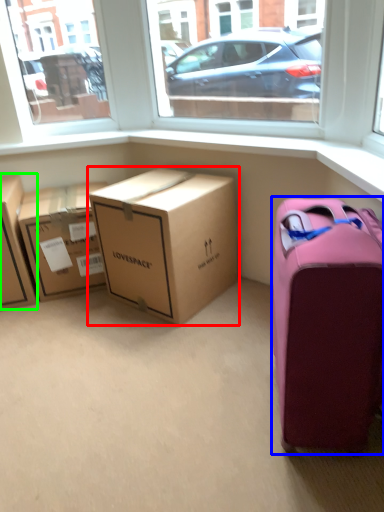
Question: Which object is the farthest from box (highlighted by a red box)? Choose among these: suitcase (highlighted by a blue box) or box (highlighted by a green box).

Choices:
 (A) suitcase
 (B) box

Answer: (A)